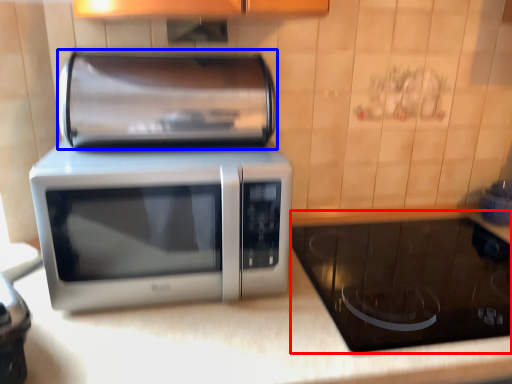
Question: Among these objects, which one is nearest to the camera, appliance (highlighted by a red box) or appliance (highlighted by a blue box)?

Choices:
 (A) appliance
 (B) appliance

Answer: (A)